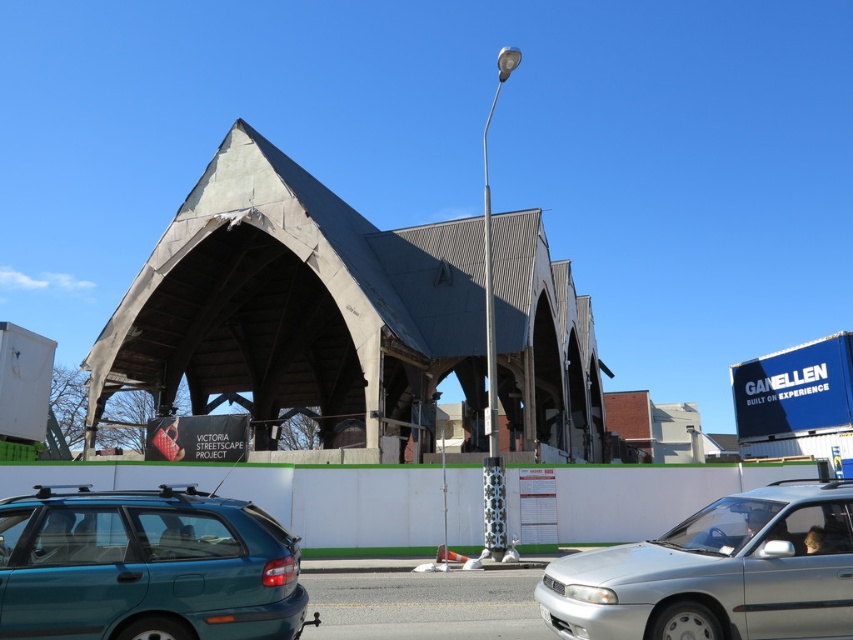
Question: Can you confirm if teal matte hatchback at lower left is bigger than silver metallic sedan at center?

Choices:
 (A) no
 (B) yes

Answer: (A)

Question: From the image, what is the correct spatial relationship of teal matte hatchback at lower left in relation to silver metallic sedan at center?

Choices:
 (A) left
 (B) right

Answer: (A)

Question: Is teal matte hatchback at lower left below silver metallic sedan at center?

Choices:
 (A) no
 (B) yes

Answer: (A)